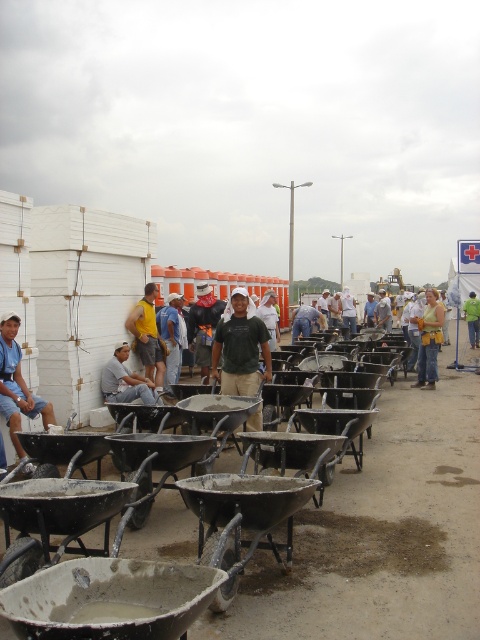
Question: Is denim shirt at center positioned in front of dark green shirt at center?

Choices:
 (A) no
 (B) yes

Answer: (B)

Question: Can you confirm if dark green t-shirt at center is thinner than matte green shirt at center?

Choices:
 (A) no
 (B) yes

Answer: (B)

Question: Considering the real-world distances, which object is closest to the denim shirt at center?

Choices:
 (A) yellow fabric shirt at center
 (B) matte blue shirt at left
 (C) matte green shirt at center

Answer: (A)

Question: Does denim shirt at center have a larger size compared to dark green shirt at center?

Choices:
 (A) yes
 (B) no

Answer: (B)

Question: Which object is farther from the camera taking this photo?

Choices:
 (A) matte green shirt at center
 (B) dark green t-shirt at center
 (C) denim shirt at center
 (D) dark green shirt at center

Answer: (D)

Question: Which of the following is the closest to the observer?

Choices:
 (A) yellow fabric shirt at center
 (B) dark green shirt at center

Answer: (A)